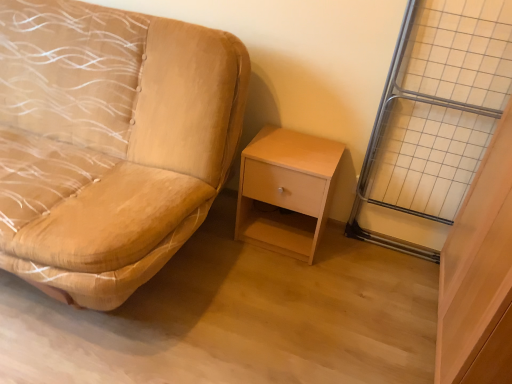
Question: Does metal grid at right have a smaller size compared to light wood/finely finished nightstand at center-right?

Choices:
 (A) yes
 (B) no

Answer: (A)

Question: Is metal grid at right positioned behind light wood/finely finished nightstand at center-right?

Choices:
 (A) yes
 (B) no

Answer: (B)

Question: Does metal grid at right come in front of light wood/finely finished nightstand at center-right?

Choices:
 (A) yes
 (B) no

Answer: (A)

Question: Would you say metal grid at right is a long distance from light wood/finely finished nightstand at center-right?

Choices:
 (A) yes
 (B) no

Answer: (B)

Question: From a real-world perspective, is metal grid at right physically above light wood/finely finished nightstand at center-right?

Choices:
 (A) no
 (B) yes

Answer: (B)

Question: Relative to metal grid at right, is light wood/finely finished nightstand at center-right in front or behind?

Choices:
 (A) front
 (B) behind

Answer: (B)

Question: Considering the positions of point pyautogui.click(x=279, y=218) and point pyautogui.click(x=425, y=59), is point pyautogui.click(x=279, y=218) closer or farther from the camera than point pyautogui.click(x=425, y=59)?

Choices:
 (A) farther
 (B) closer

Answer: (A)

Question: Considering the positions of light wood/finely finished nightstand at center-right and metal grid at right in the image, is light wood/finely finished nightstand at center-right taller or shorter than metal grid at right?

Choices:
 (A) short
 (B) tall

Answer: (A)

Question: Looking at their shapes, would you say light wood/finely finished nightstand at center-right is wider or thinner than metal grid at right?

Choices:
 (A) thin
 (B) wide

Answer: (B)

Question: Choose the correct answer: Is metal grid at right inside suede-like beige studio couch at left or outside it?

Choices:
 (A) outside
 (B) inside

Answer: (A)

Question: From their relative heights in the image, would you say metal grid at right is taller or shorter than suede-like beige studio couch at left?

Choices:
 (A) short
 (B) tall

Answer: (B)

Question: Looking at their shapes, would you say metal grid at right is wider or thinner than suede-like beige studio couch at left?

Choices:
 (A) wide
 (B) thin

Answer: (B)

Question: Is metal grid at right to the left or to the right of suede-like beige studio couch at left in the image?

Choices:
 (A) right
 (B) left

Answer: (A)

Question: Considering the positions of light wood/finely finished nightstand at center-right and suede-like beige studio couch at left in the image, is light wood/finely finished nightstand at center-right bigger or smaller than suede-like beige studio couch at left?

Choices:
 (A) big
 (B) small

Answer: (B)

Question: In terms of width, does light wood/finely finished nightstand at center-right look wider or thinner when compared to suede-like beige studio couch at left?

Choices:
 (A) thin
 (B) wide

Answer: (A)